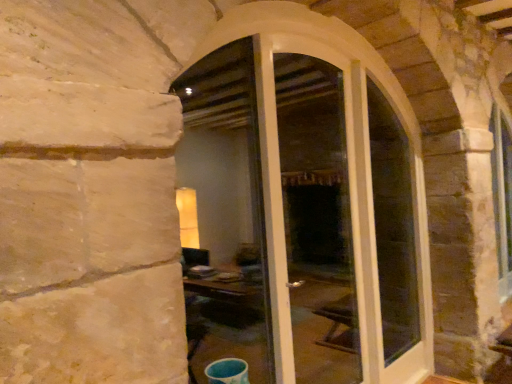
Locate an element on the screen. The width and height of the screenshot is (512, 384). vacant area on top of white glass door at center (from a real-world perspective) is located at coordinates (314, 49).